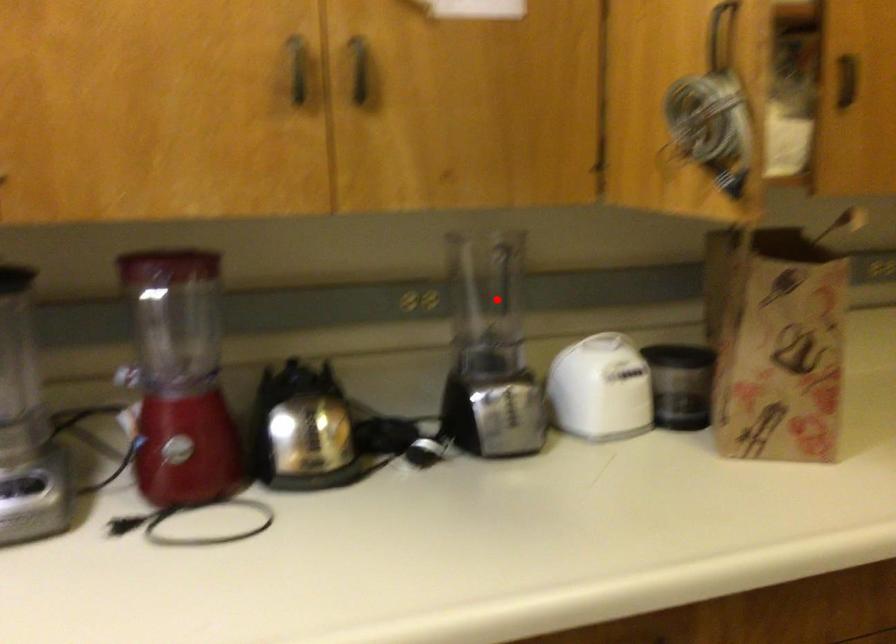
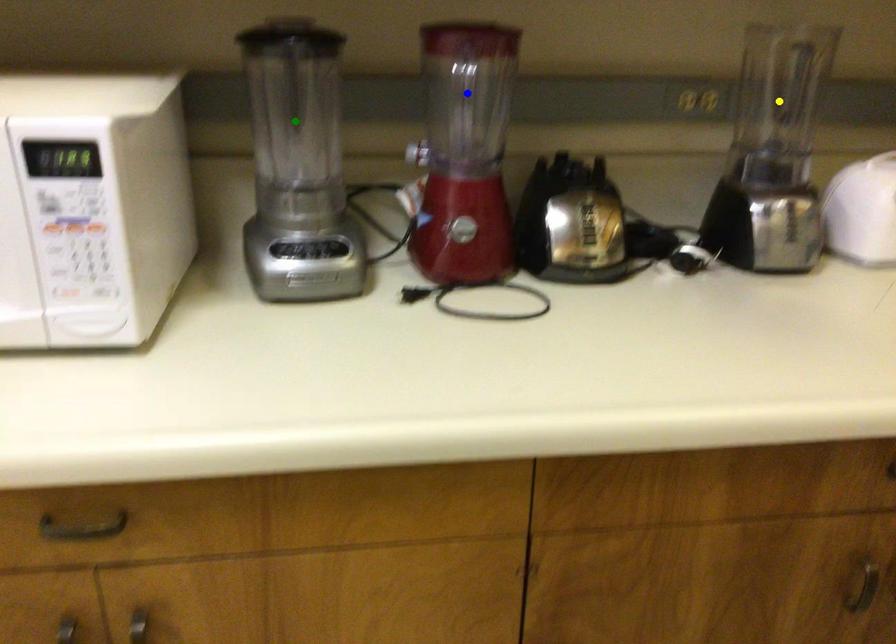
Question: I am providing you with two images of the same scene from different viewpoints. A red point is marked on the first image. You are given multiple points on the second image. Which spot in image 2 lines up with the point in image 1?

Choices:
 (A) green point
 (B) yellow point
 (C) blue point

Answer: (B)